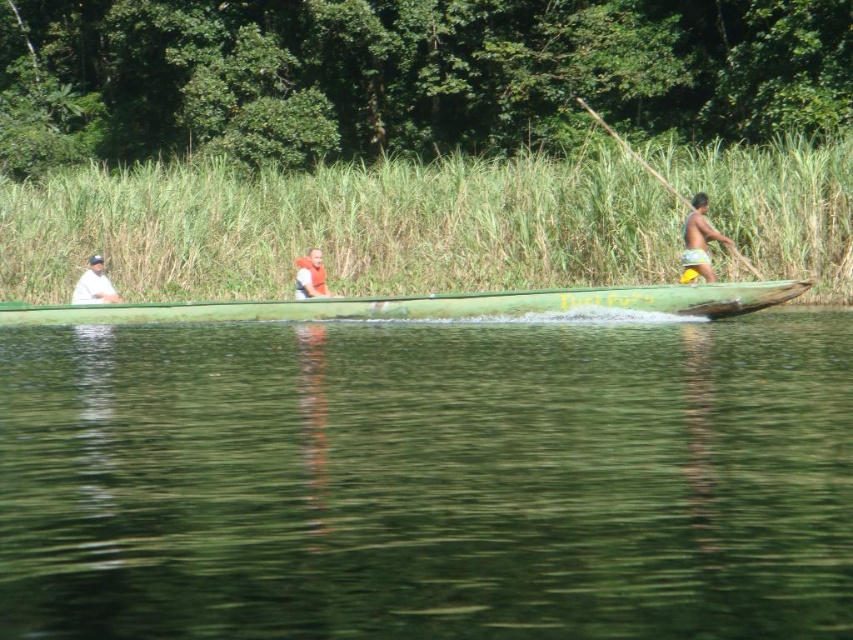
You are standing on the dock and want to throw a lifebuoy to someone in the boat. The boat has a green smooth water at center and a wooden paddle at right. Which object should you aim for to reach the front of the boat?

The green smooth water at center is in front of the wooden paddle at right, so you should aim for the green smooth water at center to reach the front of the boat.

Based on the photo, you are standing on the shore observing the boat with two points marked on it. The points are labeled as point (268, 604) and point (312, 260). If you want to throw a small object to the person nearest to you on the boat, which point should you aim for?

You should aim for point (268, 604) because it is closer to the camera, meaning that part of the boat is nearer to the shore where you are standing.

You are standing on the shore and looking at the boat. There are two points marked on the boat. One is at point (x=100, y=291) and the other is at point (x=321, y=275). Which point is closer to you?

Point (x=100, y=291) is closer to you because it is further to the viewer than point (x=321, y=275).